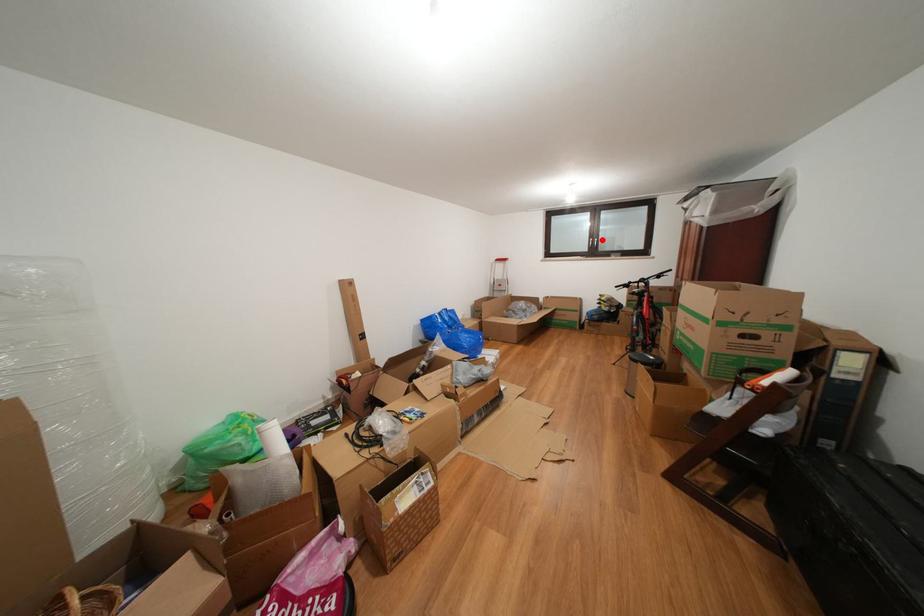
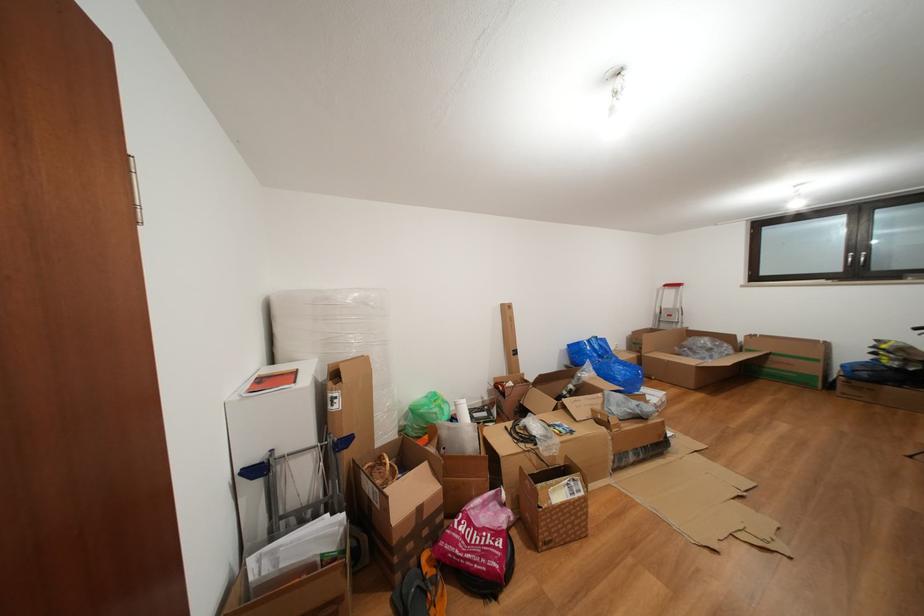
The point at the highlighted location is marked in the first image. Where is the corresponding point in the second image?

(866, 252)